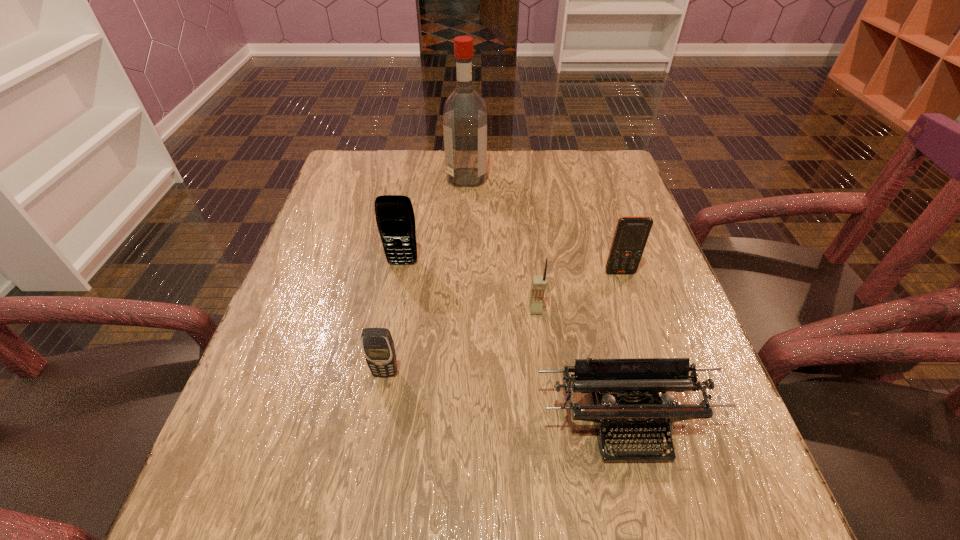
The image size is (960, 540). What are the coordinates of `free space at the far edge of the desktop` in the screenshot? It's located at (488, 194).

Where is `blank space at the left edge of the desktop`? blank space at the left edge of the desktop is located at coordinates (352, 296).

In order to click on vacant space at the right edge of the desktop in this screenshot , I will do `click(625, 285)`.

In the image, there is a desktop. At what (x,y) coordinates should I click in order to perform the action: click on free space at the far left corner. Please return your answer as a coordinate pair (x, y). Looking at the image, I should click on (349, 189).

The height and width of the screenshot is (540, 960). In the image, there is a desktop. In order to click on vacant space at the near right corner in this screenshot , I will do `click(755, 536)`.

Where is `vacant space that is in between the fifth farthest object and the tallest object`? This screenshot has width=960, height=540. vacant space that is in between the fifth farthest object and the tallest object is located at coordinates (426, 275).

I want to click on blank region between the shortest object and the rightmost cellular telephone, so click(624, 348).

Locate an element on the screen. This screenshot has width=960, height=540. empty location between the fourth object from right to left and the third cellular telephone from left to right is located at coordinates (501, 244).

Locate an element on the screen. The height and width of the screenshot is (540, 960). vacant space that is in between the nearest cellular telephone and the third nearest object is located at coordinates (461, 341).

Where is `vacant point located between the farthest cellular telephone and the nearest object`? Image resolution: width=960 pixels, height=540 pixels. vacant point located between the farthest cellular telephone and the nearest object is located at coordinates (515, 343).